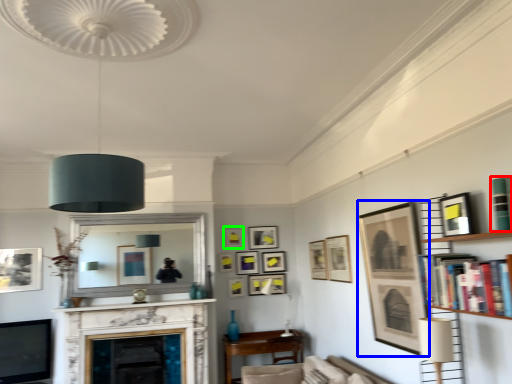
Question: Estimate the real-world distances between objects in this image. Which object is farther from book (highlighted by a red box), picture frame (highlighted by a blue box) or picture frame (highlighted by a green box)?

Choices:
 (A) picture frame
 (B) picture frame

Answer: (B)